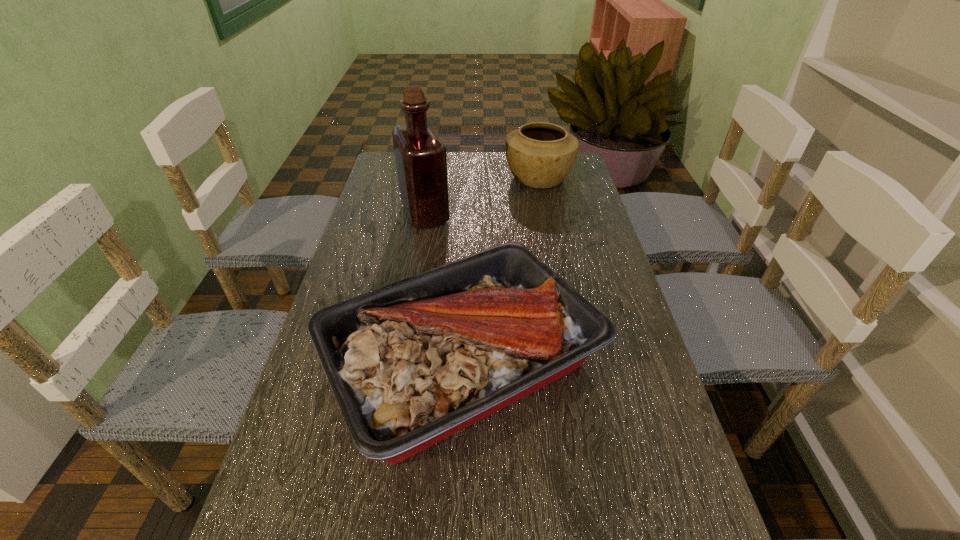
Where is `liquor`? The width and height of the screenshot is (960, 540). liquor is located at coordinates (421, 161).

Identify the location of the tallest object. This screenshot has width=960, height=540. (421, 161).

Locate an element on the screen. This screenshot has height=540, width=960. the farthest object is located at coordinates (540, 155).

I want to click on the shortest object, so click(x=411, y=363).

You are a GUI agent. You are given a task and a screenshot of the screen. Output one action in this format:
    pyautogui.click(x=<x>, y=<y>)
    Task: Click on the tray
    The height and width of the screenshot is (540, 960).
    Given the screenshot: What is the action you would take?
    pyautogui.click(x=411, y=363)

I want to click on vacant region located on the right of the liquor, so click(494, 213).

Locate an element on the screen. The image size is (960, 540). free region located 0.360m on the left of the pottery is located at coordinates coord(403,178).

This screenshot has width=960, height=540. Find the location of `vacant point located on the back of the tray`. vacant point located on the back of the tray is located at coordinates (467, 247).

Where is `object that is at the far edge`? The width and height of the screenshot is (960, 540). object that is at the far edge is located at coordinates (540, 155).

Locate an element on the screen. The height and width of the screenshot is (540, 960). liquor that is at the left edge is located at coordinates (421, 161).